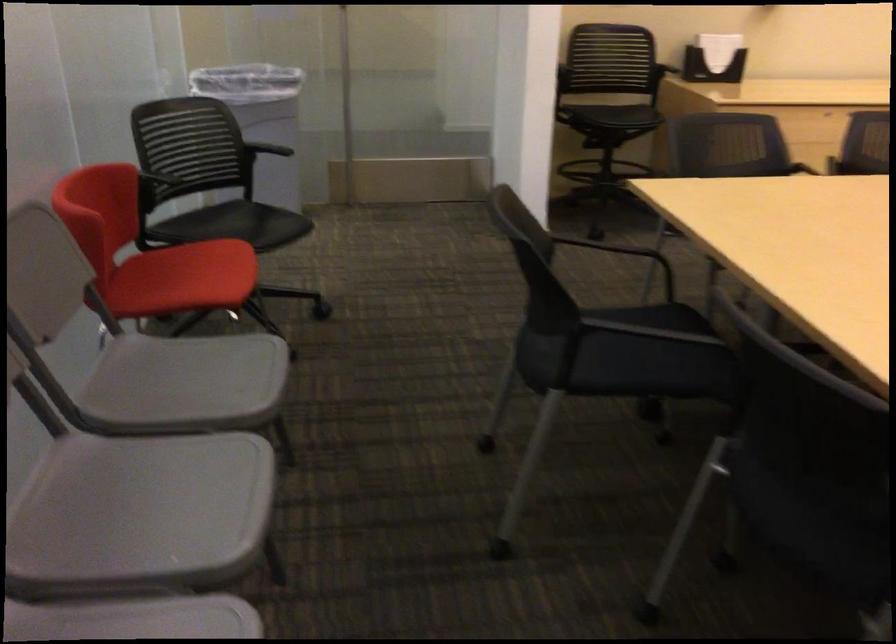
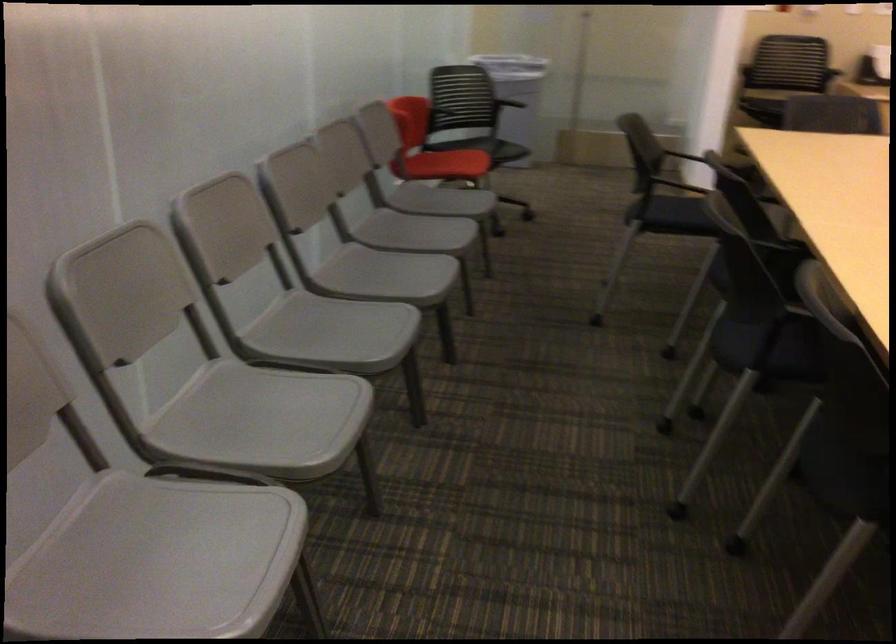
Where in the second image is the point corresponding to pixel 178 299 from the first image?

(446, 164)